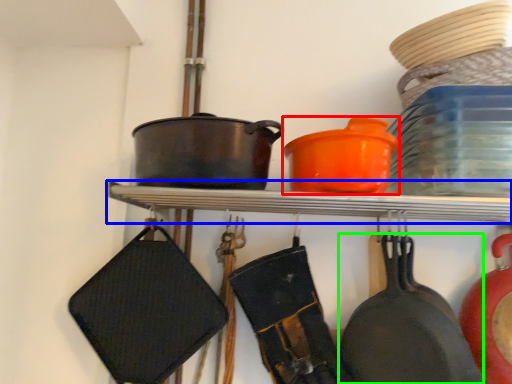
Question: Which object is the closest to the tableware (highlighted by a red box)? Choose among these: shelf (highlighted by a blue box) or frying pan (highlighted by a green box).

Choices:
 (A) shelf
 (B) frying pan

Answer: (A)